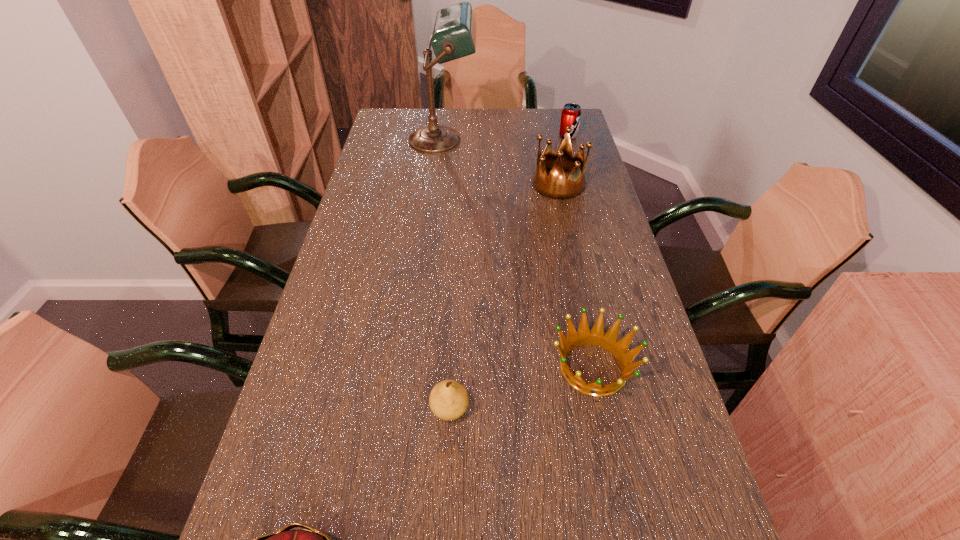
This screenshot has height=540, width=960. Identify the location of table lamp. (454, 35).

Find the location of a particular element. the tallest crown is located at coordinates (555, 185).

Identify the location of the second tallest object. (555, 185).

Identify the location of soda can. This screenshot has width=960, height=540. (571, 113).

I want to click on pear, so click(x=448, y=400).

Identify the location of the second farthest crown. The image size is (960, 540). pyautogui.click(x=596, y=337).

Identify the location of free location located above the green lampshade of the table lamp. The image size is (960, 540). (500, 140).

Where is `free spot located 0.190m on the left of the third farthest object`? free spot located 0.190m on the left of the third farthest object is located at coordinates click(x=477, y=184).

The image size is (960, 540). I want to click on free space located on the left of the soda can, so click(x=518, y=136).

Find the location of a particular element. vacant area located on the left of the pear is located at coordinates point(346,409).